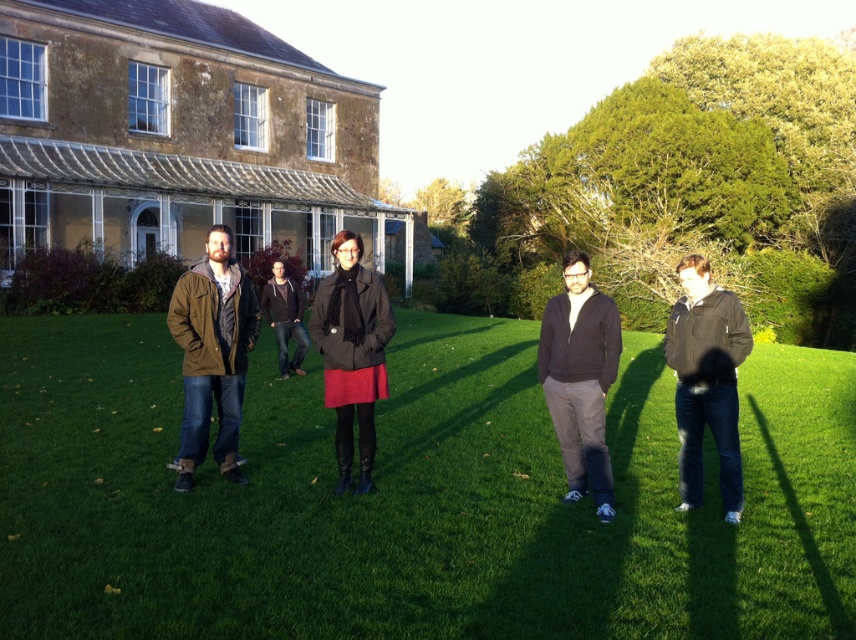
Question: Which object is farther from the camera taking this photo?

Choices:
 (A) dark gray sweater at center
 (B) matte brown jacket at left
 (C) dark gray fleece jacket at center
 (D) black matte jacket at center

Answer: (A)

Question: Is matte brown jacket at left wider than dark gray sweater at center?

Choices:
 (A) no
 (B) yes

Answer: (A)

Question: Among these points, which one is farthest from the camera?

Choices:
 (A) coord(9,416)
 (B) coord(580,259)
 (C) coord(223,468)
 (D) coord(704,262)

Answer: (A)

Question: Can you confirm if matte brown jacket at left is positioned above dark gray sweater at center?

Choices:
 (A) yes
 (B) no

Answer: (B)

Question: Which of these objects is positioned closest to the green grass at center?

Choices:
 (A) black matte jacket at center
 (B) matte brown jacket at left
 (C) dark gray fleece jacket at center
 (D) matte black coat at center

Answer: (C)

Question: Can you confirm if dark gray fleece jacket at center is bigger than matte black coat at center?

Choices:
 (A) no
 (B) yes

Answer: (B)